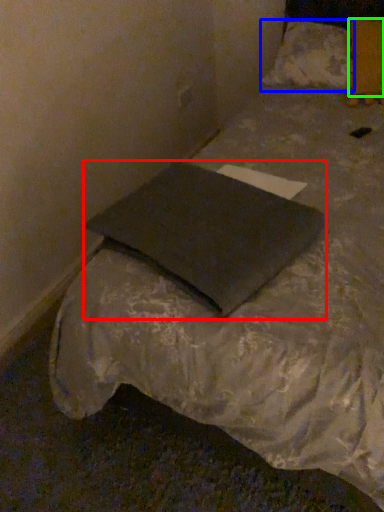
Question: Which is nearer to the pillow (highlighted by a red box)? pillow (highlighted by a blue box) or pillow (highlighted by a green box).

Choices:
 (A) pillow
 (B) pillow

Answer: (B)